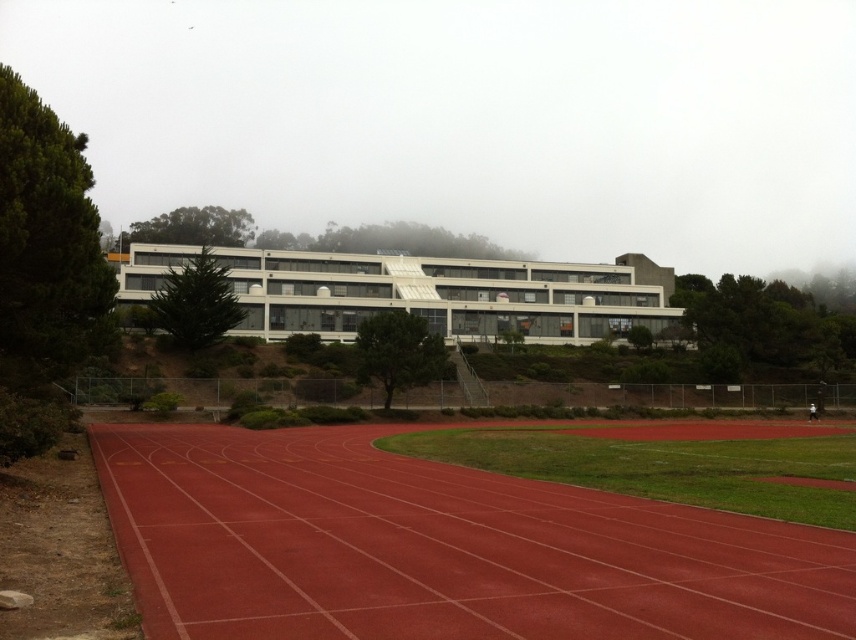
Question: Which of the following is the closest to the observer?

Choices:
 (A) (x=634, y=300)
 (B) (x=622, y=508)

Answer: (B)

Question: Which point is closer to the camera?

Choices:
 (A) (354, 307)
 (B) (395, 579)

Answer: (B)

Question: Can you confirm if rubber running track at center is positioned above white matte building at center?

Choices:
 (A) yes
 (B) no

Answer: (B)

Question: Is rubber running track at center thinner than white matte building at center?

Choices:
 (A) no
 (B) yes

Answer: (B)

Question: Can you confirm if rubber running track at center is bigger than white matte building at center?

Choices:
 (A) no
 (B) yes

Answer: (A)

Question: Which point is farther from the camera taking this photo?

Choices:
 (A) (114, 440)
 (B) (572, 317)

Answer: (B)